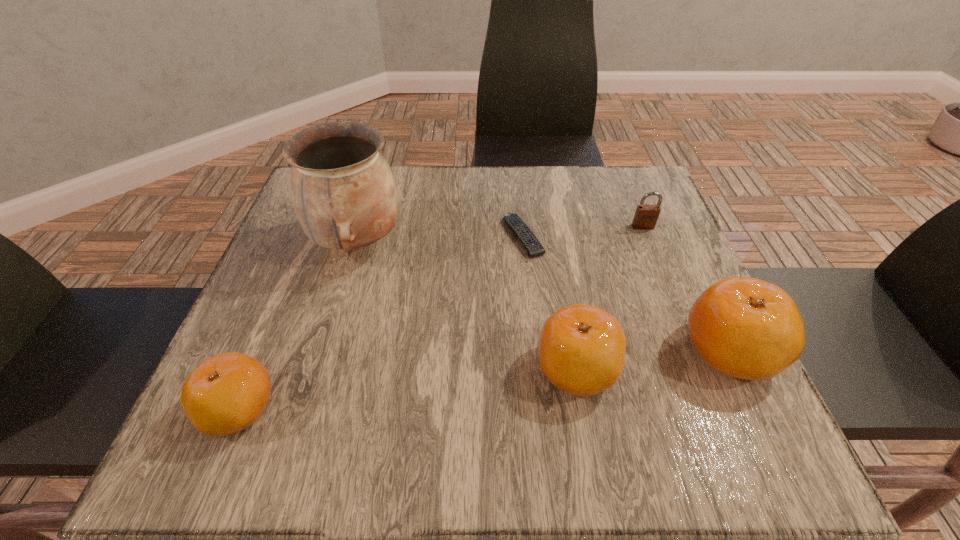
The width and height of the screenshot is (960, 540). I want to click on free space that is in between the rightmost clementine and the remote control, so click(x=626, y=294).

Where is `vacant region between the padlock and the rightmost clementine`? The image size is (960, 540). vacant region between the padlock and the rightmost clementine is located at coordinates (685, 289).

This screenshot has width=960, height=540. I want to click on vacant area that lies between the third tallest object and the shortest clementine, so click(x=408, y=389).

The width and height of the screenshot is (960, 540). I want to click on free space between the padlock and the shortest object, so click(x=583, y=232).

Identify the location of vacant region between the remote control and the second clementine from left to right. (550, 302).

The width and height of the screenshot is (960, 540). I want to click on vacant region between the padlock and the leftmost clementine, so click(442, 318).

You are a GUI agent. You are given a task and a screenshot of the screen. Output one action in this format:
    pyautogui.click(x=<x>, y=<y>)
    Task: Click on the vacant area that lies between the padlock and the rightmost clementine
    
    Given the screenshot: What is the action you would take?
    pyautogui.click(x=685, y=289)

Select which object is the fourth closest to the rightmost clementine. Please provide its 2D coordinates. Your answer should be formatted as a tuple, i.e. [(x, y)], where the tuple contains the x and y coordinates of a point satisfying the conditions above.

[(344, 195)]

In order to click on the second closest object to the rightmost clementine in this screenshot , I will do `click(646, 216)`.

You are a GUI agent. You are given a task and a screenshot of the screen. Output one action in this format:
    pyautogui.click(x=<x>, y=<y>)
    Task: Click on the clementine object that ranks as the closest to the remote control
    Image resolution: width=960 pixels, height=540 pixels.
    Given the screenshot: What is the action you would take?
    pyautogui.click(x=582, y=348)